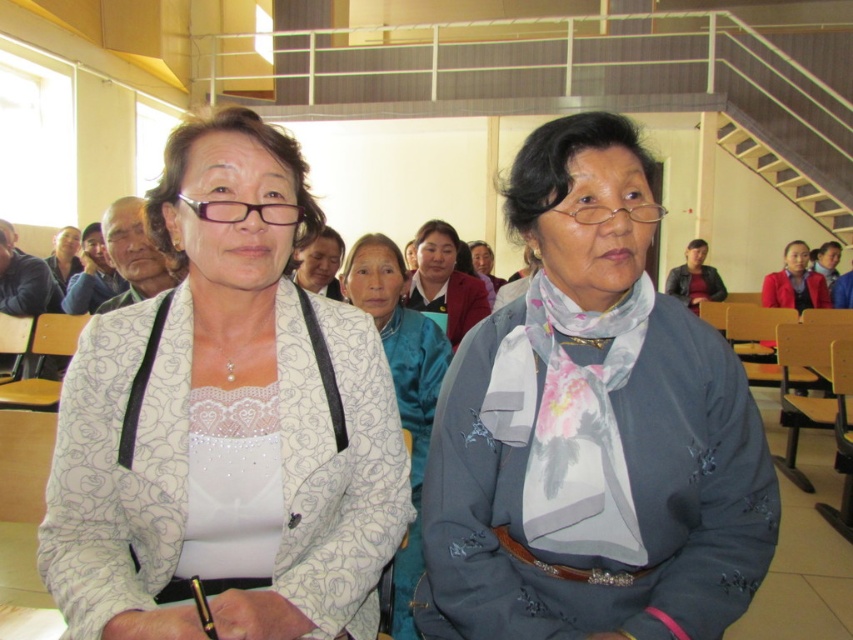
You are organizing a fashion show and need to display two scarves on a mannequin. The gray fabric scarf at center and the blue silk scarf at center must be placed side by side. Which scarf should you place on the left side to ensure they are arranged from smallest to largest?

The gray fabric scarf at center is smaller than the blue silk scarf at center, so you should place the gray fabric scarf at center on the left and the blue silk scarf at center on the right to arrange them from smallest to largest.

You are standing at the entrance of the classroom and see the point marked at coordinates (593,426). What object is located at that point?

The gray fabric scarf at center is located at point (593,426).